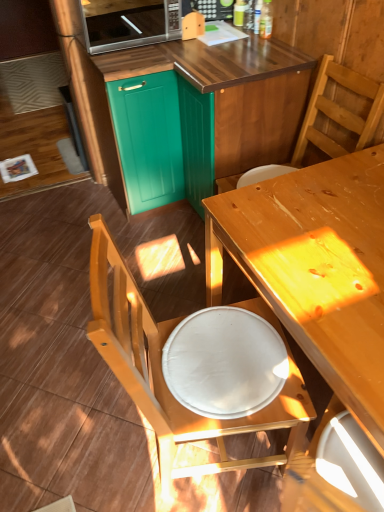
Question: Could you tell me if teal wood cabinet at upper center, marked as the 2th cabinetry in a left-to-right arrangement, is turned towards wooden table at center?

Choices:
 (A) yes
 (B) no

Answer: (B)

Question: Can you confirm if teal wood cabinet at upper center, marked as the 1th cabinetry in a right-to-left arrangement, is taller than wooden table at center?

Choices:
 (A) yes
 (B) no

Answer: (A)

Question: Is teal wood cabinet at upper center, marked as the 2th cabinetry in a left-to-right arrangement, positioned behind wooden table at center?

Choices:
 (A) yes
 (B) no

Answer: (A)

Question: Is teal wood cabinet at upper center, marked as the 2th cabinetry in a left-to-right arrangement, at the right side of wooden table at center?

Choices:
 (A) yes
 (B) no

Answer: (B)

Question: Is teal wood cabinet at upper center, marked as the 2th cabinetry in a left-to-right arrangement, bigger than wooden table at center?

Choices:
 (A) yes
 (B) no

Answer: (A)

Question: Is white glossy plate at lower center bigger or smaller than teal wood cabinet at upper center, marked as the 2th cabinetry in a left-to-right arrangement?

Choices:
 (A) big
 (B) small

Answer: (B)

Question: Is white glossy plate at lower center wider or thinner than teal wood cabinet at upper center, marked as the 2th cabinetry in a left-to-right arrangement?

Choices:
 (A) wide
 (B) thin

Answer: (B)

Question: From the image's perspective, is white glossy plate at lower center above or below teal wood cabinet at upper center, marked as the 1th cabinetry in a right-to-left arrangement?

Choices:
 (A) above
 (B) below

Answer: (B)

Question: In the image, is white glossy plate at lower center on the left side or the right side of teal wood cabinet at upper center, marked as the 2th cabinetry in a left-to-right arrangement?

Choices:
 (A) left
 (B) right

Answer: (B)

Question: Is satin silver microwave at upper center in front of or behind wooden chair at upper right, arranged as the first chair when viewed from the top, in the image?

Choices:
 (A) front
 (B) behind

Answer: (B)

Question: Looking at their shapes, would you say satin silver microwave at upper center is wider or thinner than wooden chair at upper right, arranged as the first chair when viewed from the top?

Choices:
 (A) thin
 (B) wide

Answer: (B)

Question: From their relative heights in the image, would you say satin silver microwave at upper center is taller or shorter than wooden chair at upper right, arranged as the first chair when viewed from the top?

Choices:
 (A) tall
 (B) short

Answer: (B)

Question: From a real-world perspective, is satin silver microwave at upper center positioned above or below wooden chair at upper right, acting as the 2th chair starting from the bottom?

Choices:
 (A) below
 (B) above

Answer: (B)

Question: From a real-world perspective, is white glossy plate at lower center physically located above or below wooden chair at lower left, the first chair in the bottom-to-top sequence?

Choices:
 (A) above
 (B) below

Answer: (A)

Question: From the image's perspective, is white glossy plate at lower center positioned above or below wooden chair at lower left, the second chair in the top-to-bottom sequence?

Choices:
 (A) above
 (B) below

Answer: (A)